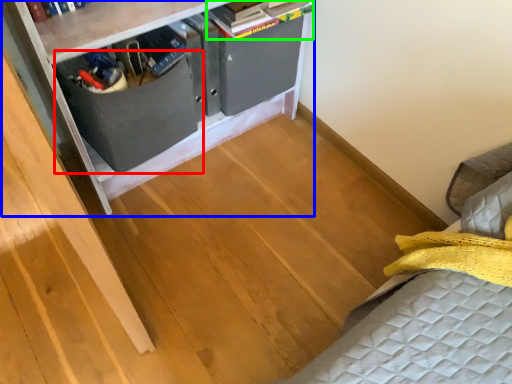
Question: Which object is positioned farthest from drawer (highlighted by a red box)? Select from furniture (highlighted by a blue box) and book (highlighted by a green box).

Choices:
 (A) furniture
 (B) book

Answer: (B)